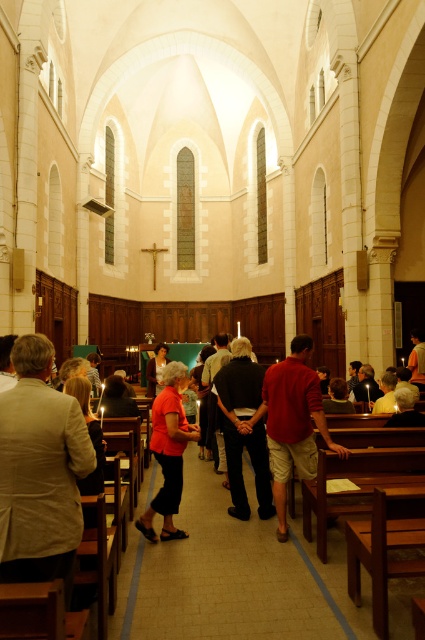
Can you confirm if red cotton shirt at center is positioned below matte red blouse at center?

Yes.

Which is above, red cotton shirt at center or matte red blouse at center?

matte red blouse at center is above.

Who is more distant from viewer, (325,435) or (161,490)?

The point (161,490) is more distant.

Find the location of a particular element. red cotton shirt at center is located at coordinates (294, 422).

Describe the element at coordinates (243, 428) in the screenshot. The width and height of the screenshot is (425, 640). I see `dark brown leather jacket at center` at that location.

Between point (235, 372) and point (169, 465), which one is positioned behind?

The point (235, 372) is behind.

Find the location of a particular element. Image resolution: width=425 pixels, height=640 pixels. dark brown leather jacket at center is located at coordinates coord(243,428).

Can you confirm if light brown linen jacket at left is shorter than red cotton shirt at center?

Correct, light brown linen jacket at left is not as tall as red cotton shirt at center.

Which is below, light brown linen jacket at left or red cotton shirt at center?

red cotton shirt at center is below.

Does point (76, 433) lie behind point (295, 444)?

No, it is in front of (295, 444).

Identify the location of light brown linen jacket at left. (39, 472).